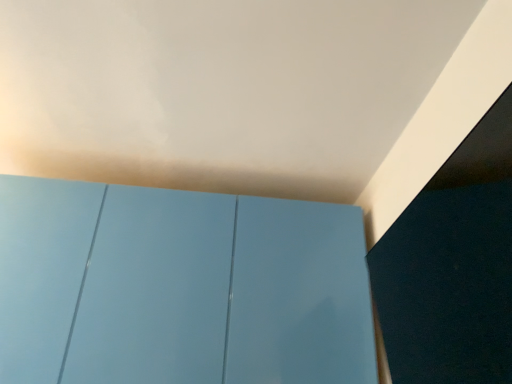
Measure the distance between matte blue cupboard at center and camera.

matte blue cupboard at center and camera are 4.23 feet apart from each other.

The height and width of the screenshot is (384, 512). Find the location of `matte blue cupboard at center`. matte blue cupboard at center is located at coordinates (179, 287).

Describe the element at coordinates (179, 287) in the screenshot. Image resolution: width=512 pixels, height=384 pixels. I see `matte blue cupboard at center` at that location.

Identify the location of matte blue cupboard at center. This screenshot has height=384, width=512. (179, 287).